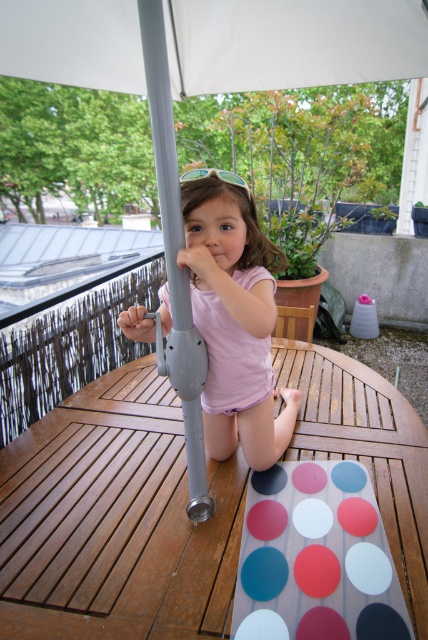
Question: Is white fabric canopy at upper center above pink matte dress at center?

Choices:
 (A) yes
 (B) no

Answer: (A)

Question: Which object appears closest to the camera in this image?

Choices:
 (A) matte white circle at center
 (B) wooden table at center

Answer: (B)

Question: Which point is farther from the camera taking this photo?

Choices:
 (A) (139, 596)
 (B) (363, 589)
 (C) (270, 316)
 (D) (175, 88)

Answer: (D)

Question: Is white fabric canopy at upper center smaller than matte gray pole at center?

Choices:
 (A) yes
 (B) no

Answer: (B)

Question: Is white fabric canopy at upper center below matte white circle at center?

Choices:
 (A) yes
 (B) no

Answer: (B)

Question: Which object appears closest to the camera in this image?

Choices:
 (A) matte gray pole at center
 (B) white fabric canopy at upper center
 (C) wooden table at center
 (D) matte white circle at center

Answer: (A)